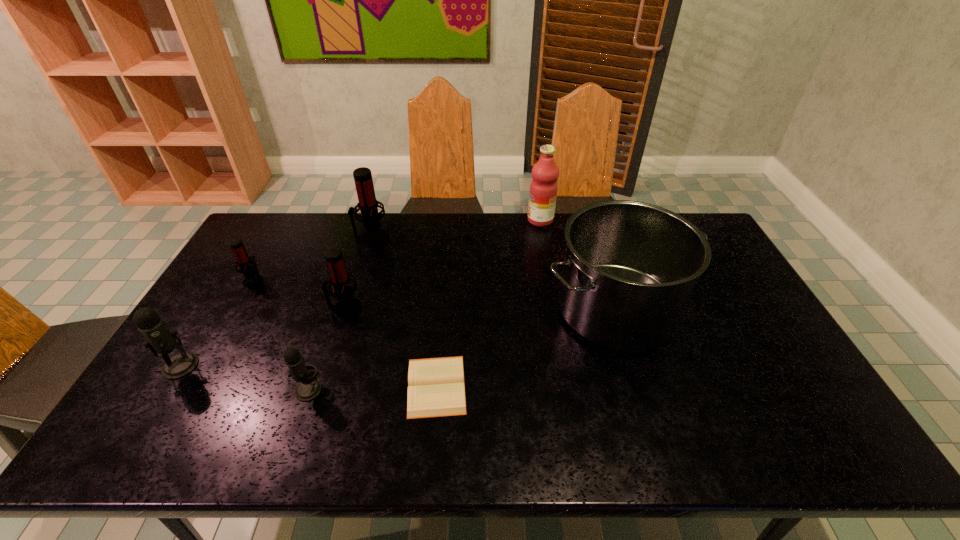
Find the location of a particular element. This screenshot has height=540, width=960. vacant area between the farthest object and the leftmost red microphone is located at coordinates (397, 250).

The width and height of the screenshot is (960, 540). Identify the location of free space between the leftmost red microphone and the farthest microphone. (313, 259).

Image resolution: width=960 pixels, height=540 pixels. I want to click on vacant point located between the saucepan and the shortest object, so click(526, 348).

This screenshot has height=540, width=960. Find the location of `vacant space that's between the farthest object and the bigger black microphone`. vacant space that's between the farthest object and the bigger black microphone is located at coordinates (361, 293).

This screenshot has width=960, height=540. Identify the location of empty location between the right black microphone and the second biggest red microphone. (326, 349).

Find the location of a particular element. free spot between the third nearest microphone and the smaller black microphone is located at coordinates (326, 349).

The width and height of the screenshot is (960, 540). Find the location of `vacant space that's between the saucepan and the nearest red microphone`. vacant space that's between the saucepan and the nearest red microphone is located at coordinates (480, 309).

Where is `free space between the right black microphone and the third farthest microphone`? This screenshot has height=540, width=960. free space between the right black microphone and the third farthest microphone is located at coordinates [326, 349].

Find the location of a particular element. The height and width of the screenshot is (540, 960). unoccupied position between the saucepan and the fourth nearest microphone is located at coordinates (435, 295).

Find the location of `vacant area that lies between the smallest red microphone and the third object from right to left`. vacant area that lies between the smallest red microphone and the third object from right to left is located at coordinates (346, 333).